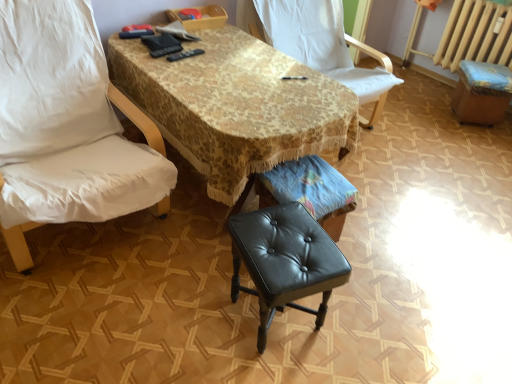
Identify the location of vacant space to the right of black leather music stool at center. (372, 248).